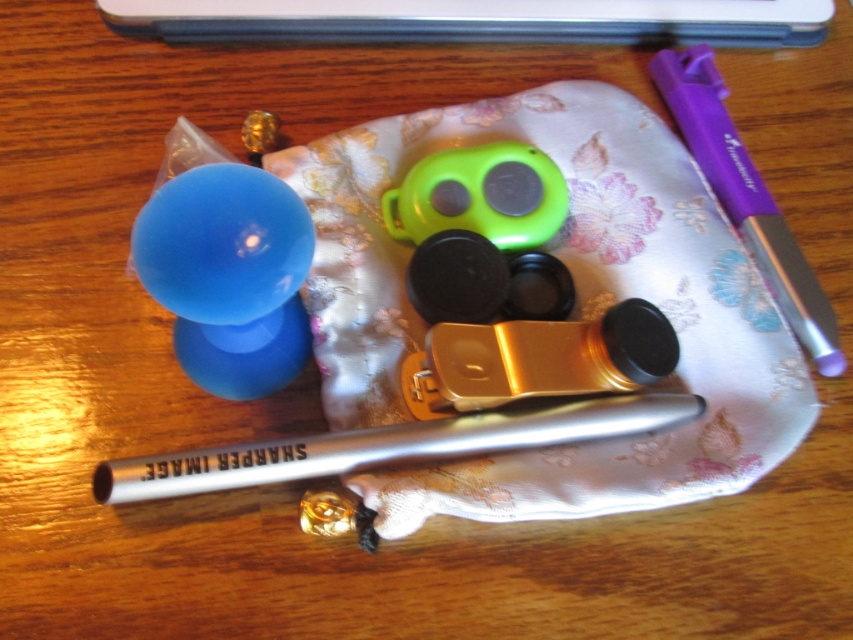
Question: Is purple plastic pen at upper right below matte blue balloon at center-left?

Choices:
 (A) no
 (B) yes

Answer: (A)

Question: Which of the following is the farthest from the observer?

Choices:
 (A) gold metallic clip at center
 (B) matte blue balloon at center-left

Answer: (B)

Question: Which object appears farthest from the camera in this image?

Choices:
 (A) gold metallic clip at center
 (B) purple plastic pen at upper right
 (C) silver metallic fountain pen at center

Answer: (B)

Question: Which point appears farthest from the camera in this image?

Choices:
 (A) (498, 372)
 (B) (230, 252)
 (C) (231, 349)

Answer: (C)

Question: From the image, what is the correct spatial relationship of gold metallic clip at center in relation to green matte remote control at center?

Choices:
 (A) left
 (B) right

Answer: (B)

Question: Does gold metallic clip at center appear on the left side of green matte remote control at center?

Choices:
 (A) no
 (B) yes

Answer: (A)